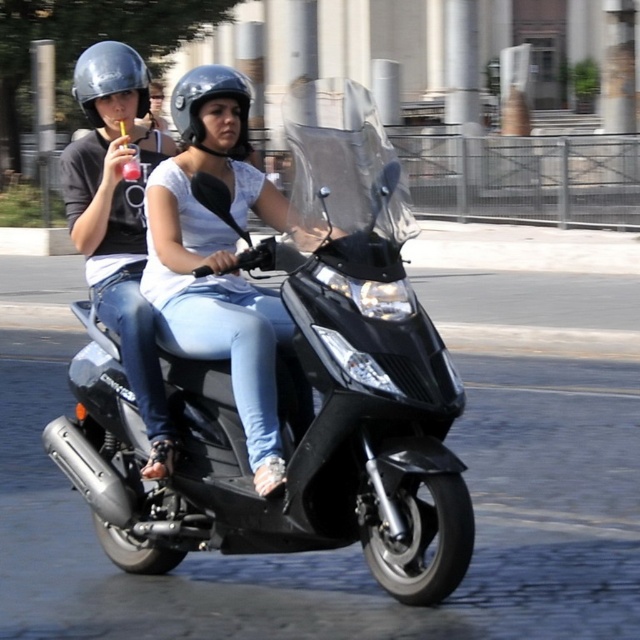
Is point (131, 196) farther from viewer compared to point (108, 93)?

Yes.

Who is taller, matte black helmet at upper left or shiny silver helmet at upper left?

shiny silver helmet at upper left

This screenshot has width=640, height=640. What do you see at coordinates (118, 220) in the screenshot?
I see `matte black helmet at upper left` at bounding box center [118, 220].

You are a GUI agent. You are given a task and a screenshot of the screen. Output one action in this format:
    pyautogui.click(x=<x>, y=<y>)
    Task: Click on the matte black helmet at upper left
    The image size is (640, 640).
    Given the screenshot: What is the action you would take?
    pyautogui.click(x=118, y=220)

Where is `black matte scooter at center`? The height and width of the screenshot is (640, 640). black matte scooter at center is located at coordinates (289, 380).

The image size is (640, 640). Identify the location of black matte scooter at center. (289, 380).

Who is positioned more to the right, matte black helmet at center or shiny silver helmet at upper left?

Positioned to the right is matte black helmet at center.

Is point (188, 93) farther from camera compared to point (148, 84)?

No, it is in front of (148, 84).

Between point (209, 88) and point (100, 93), which one is positioned behind?

The point (100, 93) is more distant.

This screenshot has width=640, height=640. In order to click on matte black helmet at center in this screenshot , I will do `click(209, 99)`.